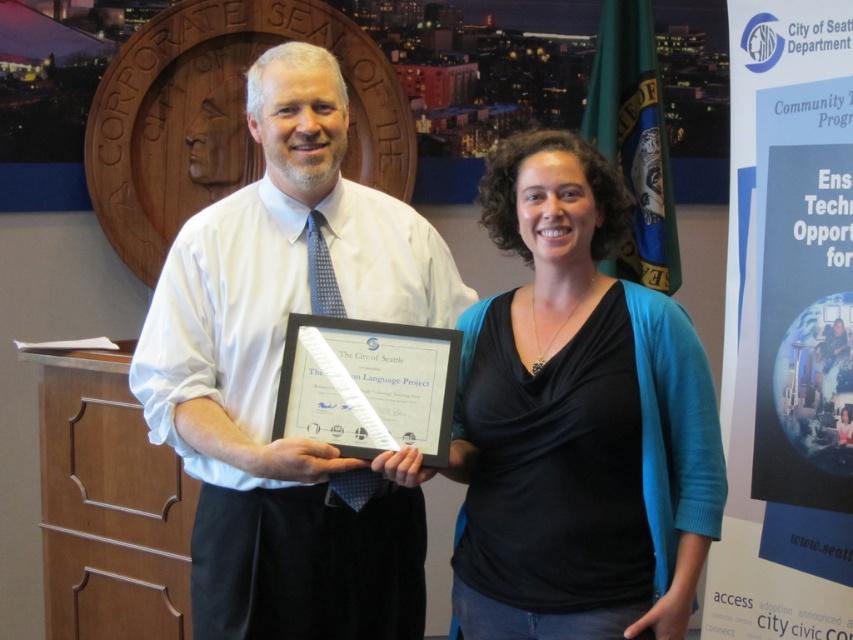
Question: From the image, what is the correct spatial relationship of white shirt at center in relation to black matte card at center?

Choices:
 (A) above
 (B) below

Answer: (A)

Question: Does black matte card at center appear over white paper at center?

Choices:
 (A) no
 (B) yes

Answer: (B)

Question: Can you confirm if black matte card at center is bigger than beech wood drawer at lower left?

Choices:
 (A) no
 (B) yes

Answer: (B)

Question: Which object is positioned closest to the wooden at left?

Choices:
 (A) white shirt at center
 (B) black matte card at center
 (C) beech wood drawer at lower left

Answer: (C)

Question: Which object appears farthest from the camera in this image?

Choices:
 (A) beech wood drawer at lower left
 (B) white paper at center
 (C) black matte card at center
 (D) wooden at left

Answer: (A)

Question: Estimate the real-world distances between objects in this image. Which object is closer to the black matte card at center?

Choices:
 (A) wooden at left
 (B) white paper at center

Answer: (B)